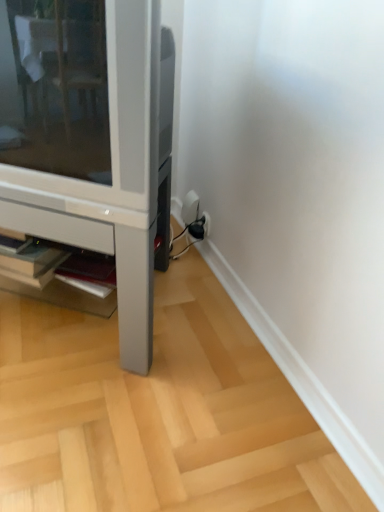
The image size is (384, 512). In order to click on vacant space in front of satin silver tv stand at lower left in this screenshot , I will do `click(99, 419)`.